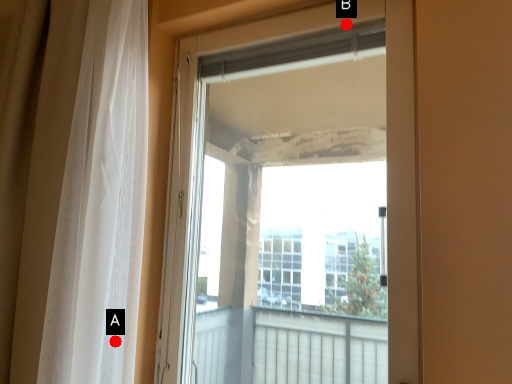
Question: Two points are circled on the image, labeled by A and B beside each circle. Among these points, which one is farthest from the camera?

Choices:
 (A) A is further
 (B) B is further

Answer: (B)